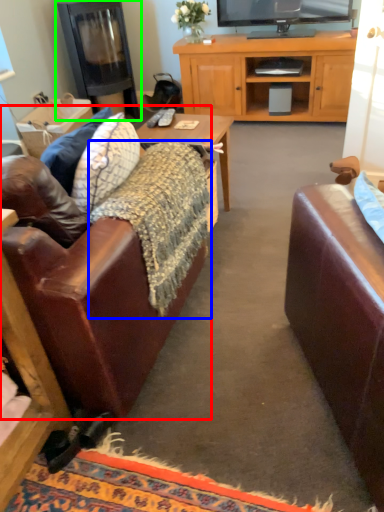
Question: Estimate the real-world distances between objects in this image. Which object is closer to studio couch (highlighted by a red box), blanket (highlighted by a blue box) or fireplace (highlighted by a green box)?

Choices:
 (A) blanket
 (B) fireplace

Answer: (A)